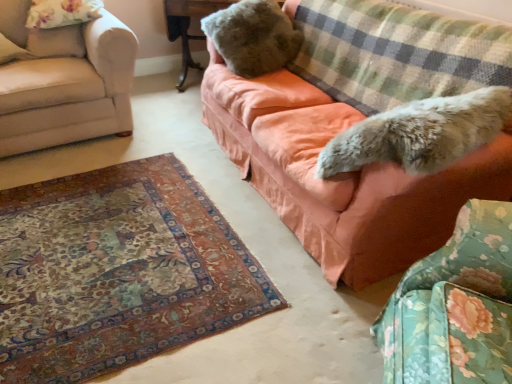
Question: Is fuzzy brown teddy bear at upper center outside of wooden table at upper center?

Choices:
 (A) no
 (B) yes

Answer: (B)

Question: Is wooden table at upper center inside fuzzy brown teddy bear at upper center?

Choices:
 (A) yes
 (B) no

Answer: (B)

Question: Can you confirm if fuzzy brown teddy bear at upper center is taller than wooden table at upper center?

Choices:
 (A) yes
 (B) no

Answer: (B)

Question: Is fuzzy brown teddy bear at upper center looking in the opposite direction of wooden table at upper center?

Choices:
 (A) no
 (B) yes

Answer: (A)

Question: From a real-world perspective, is fuzzy brown teddy bear at upper center positioned under wooden table at upper center based on gravity?

Choices:
 (A) no
 (B) yes

Answer: (A)

Question: Can you confirm if fuzzy brown teddy bear at upper center is bigger than wooden table at upper center?

Choices:
 (A) no
 (B) yes

Answer: (A)

Question: Considering the relative sizes of fuzzy brown teddy bear at upper center and fluffy fabric swivel chair at lower right in the image provided, is fuzzy brown teddy bear at upper center wider than fluffy fabric swivel chair at lower right?

Choices:
 (A) yes
 (B) no

Answer: (A)

Question: Is fuzzy brown teddy bear at upper center oriented away from fluffy fabric swivel chair at lower right?

Choices:
 (A) no
 (B) yes

Answer: (A)

Question: Does fuzzy brown teddy bear at upper center have a greater height compared to fluffy fabric swivel chair at lower right?

Choices:
 (A) yes
 (B) no

Answer: (B)

Question: Is fuzzy brown teddy bear at upper center at the left side of fluffy fabric swivel chair at lower right?

Choices:
 (A) yes
 (B) no

Answer: (A)

Question: Is fuzzy brown teddy bear at upper center further to camera compared to fluffy fabric swivel chair at lower right?

Choices:
 (A) yes
 (B) no

Answer: (A)

Question: From the image's perspective, is fuzzy brown teddy bear at upper center on top of fluffy fabric swivel chair at lower right?

Choices:
 (A) yes
 (B) no

Answer: (A)

Question: Can you confirm if wooden table at upper center is smaller than checkered fabric blanket at upper right?

Choices:
 (A) no
 (B) yes

Answer: (A)